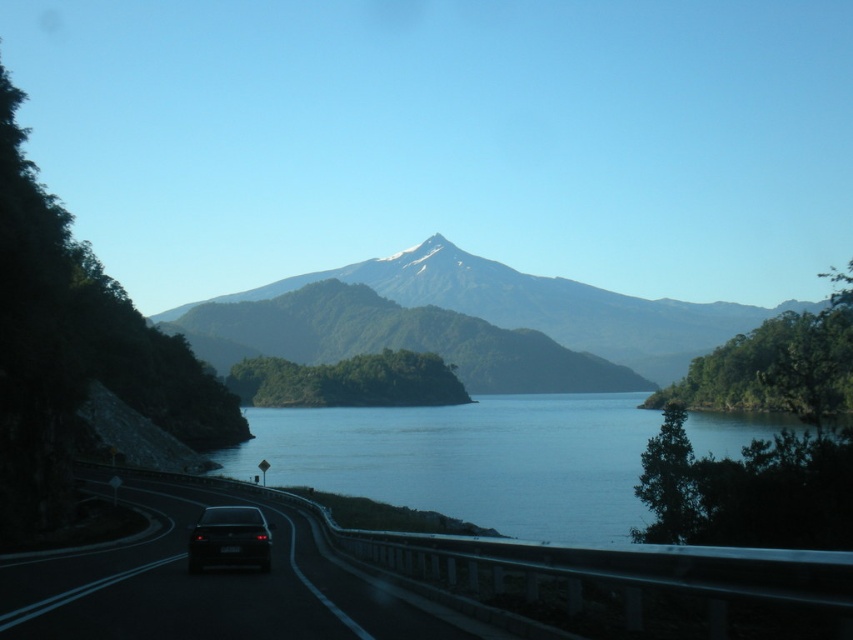
You are driving a car and see the image. There is a black asphalt highway at lower left represented by point (207, 586). Where should you steer to stay on the road?

The black asphalt highway at lower left is represented by point (207, 586), so you should steer towards that point to stay on the road.

You are driving a car and see the image ahead. There is blue water at center and a black glossy car at lower left. Which object is closer to you as you look at the scene?

The black glossy car at lower left is closer to you because the blue water at center is in front of it, meaning the car is behind the water and thus farther away.